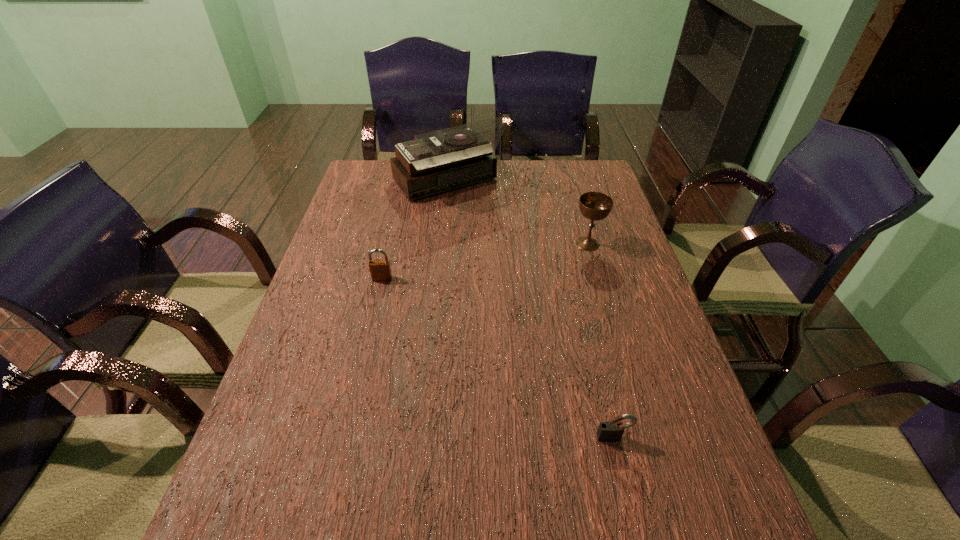
Where is `vacant space located on the front-facing side of the left padlock`? This screenshot has width=960, height=540. vacant space located on the front-facing side of the left padlock is located at coordinates [x=370, y=333].

I want to click on free space located 0.110m with the keyhole on the front of the right padlock, so click(x=628, y=501).

Locate an element on the screen. The image size is (960, 540). object that is at the far edge is located at coordinates (438, 161).

Locate an element on the screen. record player positioned at the left edge is located at coordinates (438, 161).

At what (x,y) coordinates should I click in order to perform the action: click on padlock that is at the left edge. Please return your answer as a coordinate pair (x, y). The image size is (960, 540). Looking at the image, I should click on (380, 270).

Identify the location of chalice located at the right edge. The height and width of the screenshot is (540, 960). (595, 206).

Find the location of a particular element. The image size is (960, 540). padlock that is at the right edge is located at coordinates (611, 431).

Locate an element on the screen. This screenshot has height=540, width=960. object situated at the far left corner is located at coordinates (438, 161).

This screenshot has height=540, width=960. I want to click on free space at the far edge of the desktop, so click(x=546, y=171).

This screenshot has width=960, height=540. I want to click on vacant region at the left edge of the desktop, so click(x=334, y=392).